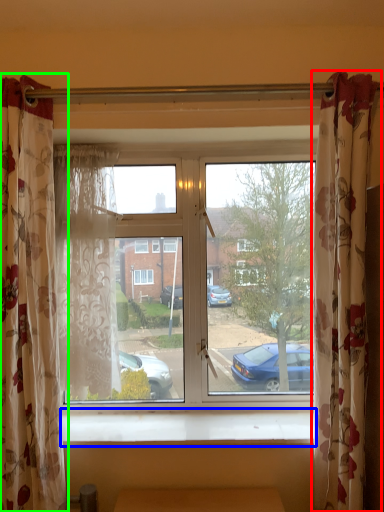
Question: Considering the real-world distances, which object is farthest from curtain (highlighted by a red box)? window sill (highlighted by a blue box) or curtain (highlighted by a green box)?

Choices:
 (A) window sill
 (B) curtain

Answer: (B)